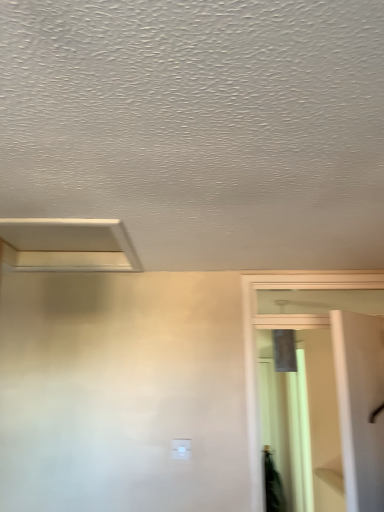
Question: Could you tell me if white matte exhaust hood at upper left is turned towards white plastic light switch at center?

Choices:
 (A) yes
 (B) no

Answer: (B)

Question: Is white matte exhaust hood at upper left turned away from white plastic light switch at center?

Choices:
 (A) yes
 (B) no

Answer: (B)

Question: Does white matte exhaust hood at upper left have a larger size compared to white plastic light switch at center?

Choices:
 (A) yes
 (B) no

Answer: (A)

Question: Is white matte exhaust hood at upper left to the left of white plastic light switch at center from the viewer's perspective?

Choices:
 (A) no
 (B) yes

Answer: (B)

Question: Can we say white matte exhaust hood at upper left lies outside white plastic light switch at center?

Choices:
 (A) no
 (B) yes

Answer: (B)

Question: From the image's perspective, is white matte exhaust hood at upper left beneath white plastic light switch at center?

Choices:
 (A) no
 (B) yes

Answer: (A)

Question: Does clear glass screen door at right turn towards white plastic light switch at center?

Choices:
 (A) yes
 (B) no

Answer: (B)

Question: Is white plastic light switch at center at the back of clear glass screen door at right?

Choices:
 (A) yes
 (B) no

Answer: (B)

Question: Can you confirm if clear glass screen door at right is taller than white plastic light switch at center?

Choices:
 (A) yes
 (B) no

Answer: (A)

Question: From a real-world perspective, is clear glass screen door at right physically above white plastic light switch at center?

Choices:
 (A) no
 (B) yes

Answer: (B)

Question: Are clear glass screen door at right and white plastic light switch at center located far from each other?

Choices:
 (A) no
 (B) yes

Answer: (A)

Question: Considering the relative sizes of clear glass screen door at right and white plastic light switch at center in the image provided, is clear glass screen door at right bigger than white plastic light switch at center?

Choices:
 (A) yes
 (B) no

Answer: (A)

Question: Considering the relative sizes of white plastic light switch at center and white matte exhaust hood at upper left in the image provided, is white plastic light switch at center shorter than white matte exhaust hood at upper left?

Choices:
 (A) no
 (B) yes

Answer: (A)